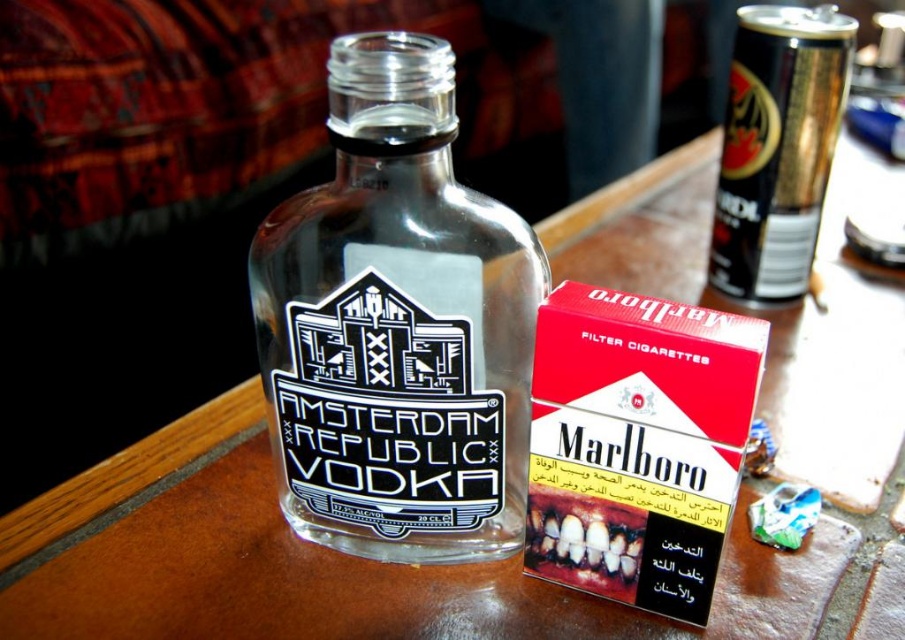
Between point (543, 284) and point (773, 150), which one is positioned in front?

Point (543, 284) is in front.

Between transparent glass bottle at center and black metallic can at upper right, which one has more height?

transparent glass bottle at center

Is point (373, 49) farther from viewer compared to point (730, 157)?

No, it is in front of (730, 157).

Where is `transparent glass bottle at center`? transparent glass bottle at center is located at coordinates (397, 324).